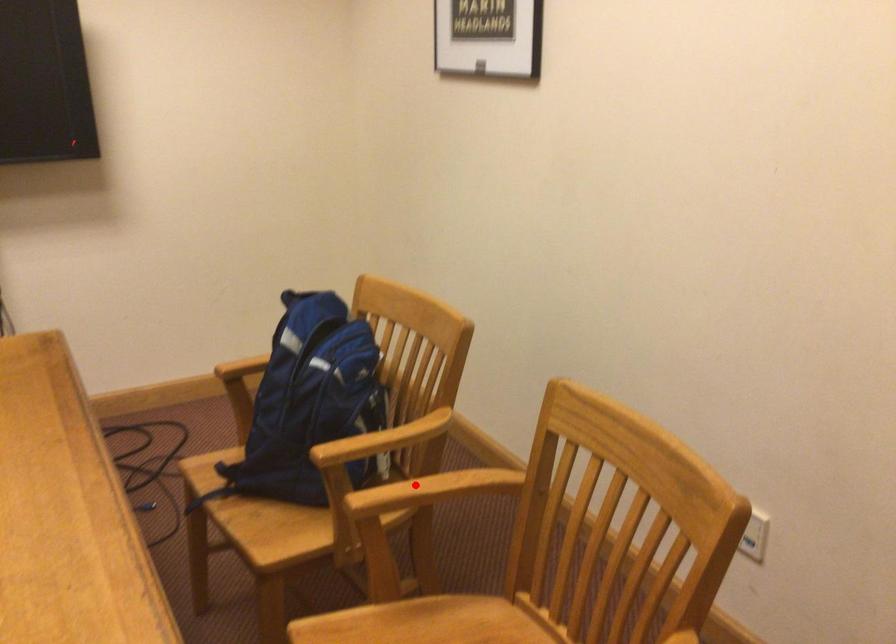
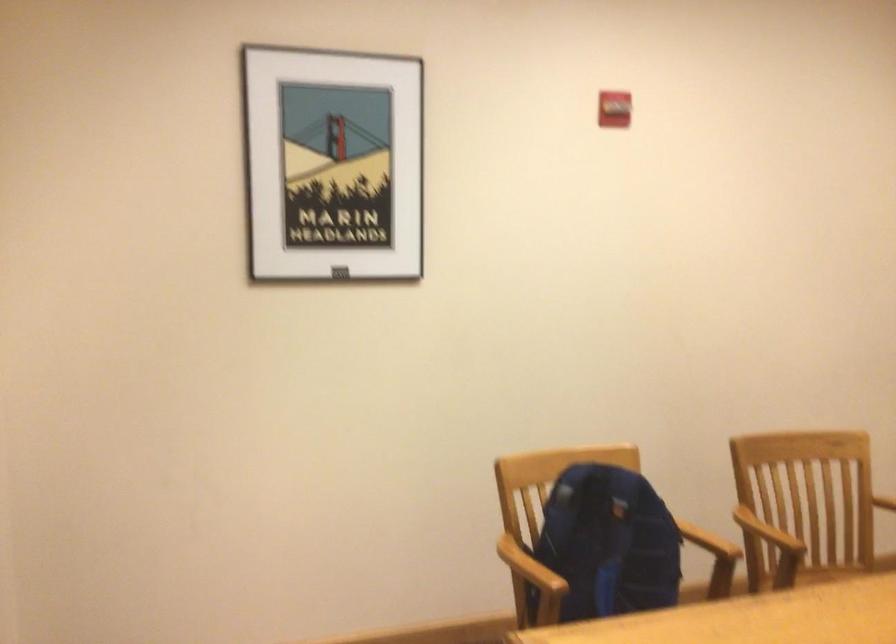
Where in the second image is the point corresponding to the highlighted location from the first image?

(767, 532)